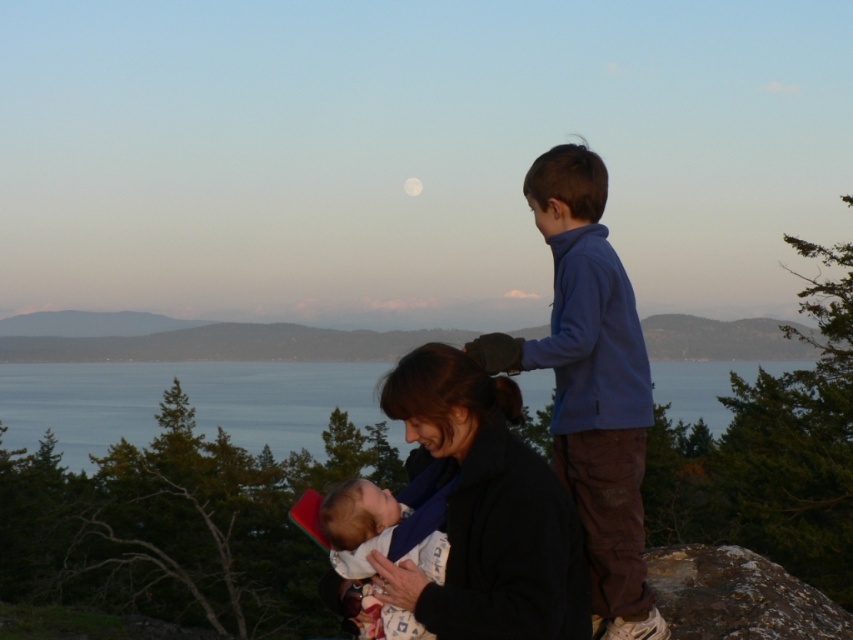
Question: Which point is closer to the camera?

Choices:
 (A) (608, 531)
 (B) (421, 628)

Answer: (B)

Question: Is black soft jacket at center in front of soft white fabric at center?

Choices:
 (A) no
 (B) yes

Answer: (B)

Question: Which point is closer to the camera?

Choices:
 (A) [361, 570]
 (B) [573, 616]
 (C) [560, 474]

Answer: (B)

Question: Can you confirm if black soft jacket at center is positioned above soft white fabric at center?

Choices:
 (A) no
 (B) yes

Answer: (B)

Question: Which point is farther to the camera?

Choices:
 (A) (399, 504)
 (B) (583, 310)
 (C) (88, 380)

Answer: (C)

Question: Is blue fleece jacket at upper right positioned before soft white fabric at center?

Choices:
 (A) yes
 (B) no

Answer: (B)